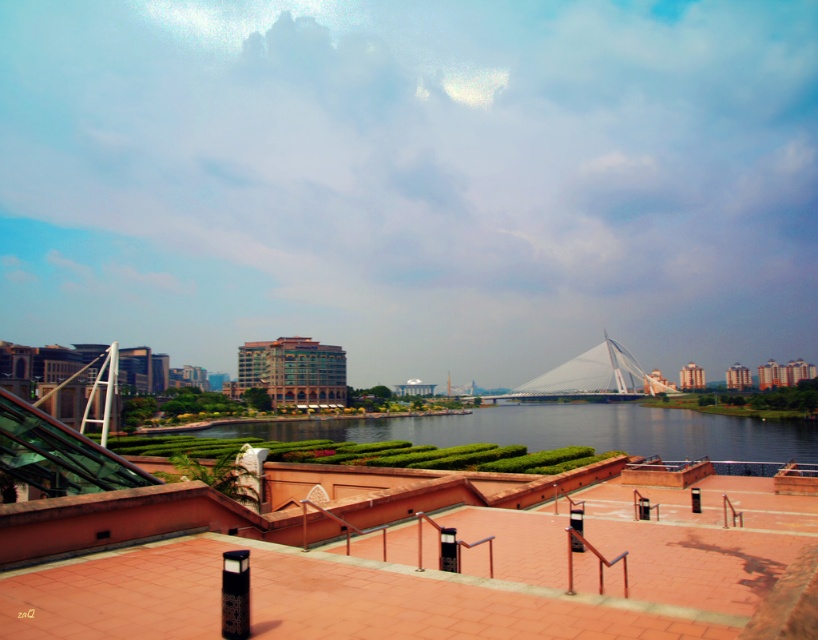
You are a drone operator planning to fly a drone from the green grassy river at center to the white glass bridge at center. According to the scene description, what is the minimum distance the drone must cover to reach the bridge?

The minimum distance the drone must cover to reach the white glass bridge at center from the green grassy river at center is 122.23 feet.

You are a landscape architect reviewing this urban space. You need to determine which area occupies more visual space in the image between the green grassy river at center and the white glass bridge at center. Which one is larger?

The green grassy river at center is bigger than the white glass bridge at center, so the green grassy river at center occupies more visual space in the image.